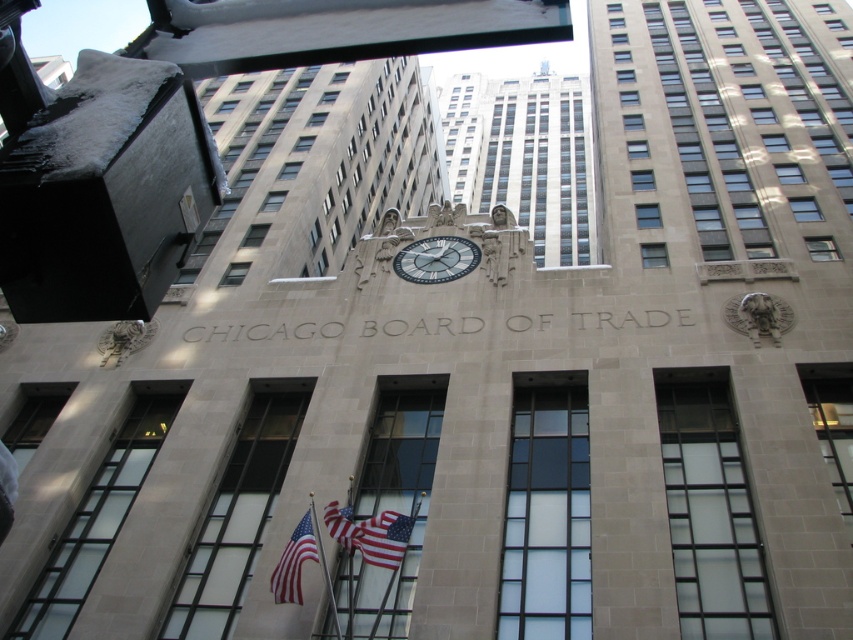
You are a photographer planning to capture the Chicago Board of Trade building. You notice a red fabric flag at center and a metallic flagpole at center. Which object should you focus on if you want to photograph the wider one?

The red fabric flag at center is wider than the metallic flagpole at center, so you should focus on the red fabric flag at center to photograph the wider one.

You are standing in front of the Chicago Board of Trade building. You notice two points marked on the facade. The first point is at coordinates point (335,506) and the second is at point (310,515). From your perspective, which point appears closer to you?

Point (310,515) appears closer to you because it is in front of point (335,506).